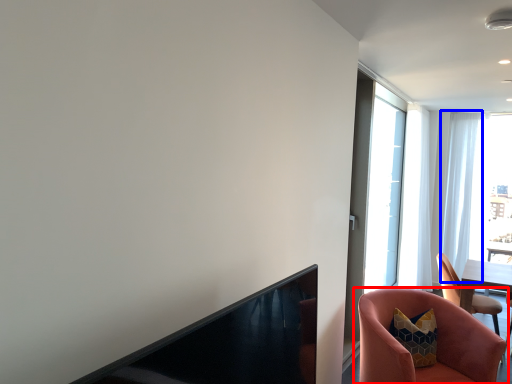
Question: Which point is further to the camera, chair (highlighted by a red box) or curtain (highlighted by a blue box)?

Choices:
 (A) chair
 (B) curtain

Answer: (B)